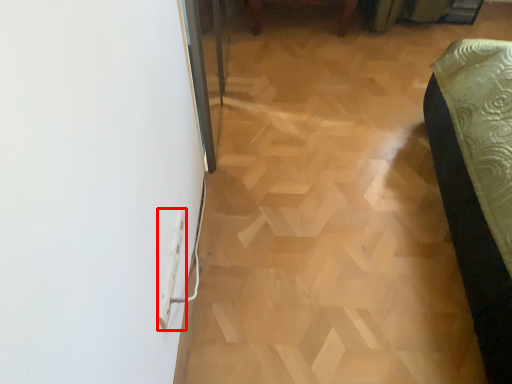
Question: From the image's perspective, what is the correct spatial positioning of electric outlet (annotated by the red box) in reference to plywood?

Choices:
 (A) above
 (B) below

Answer: (B)